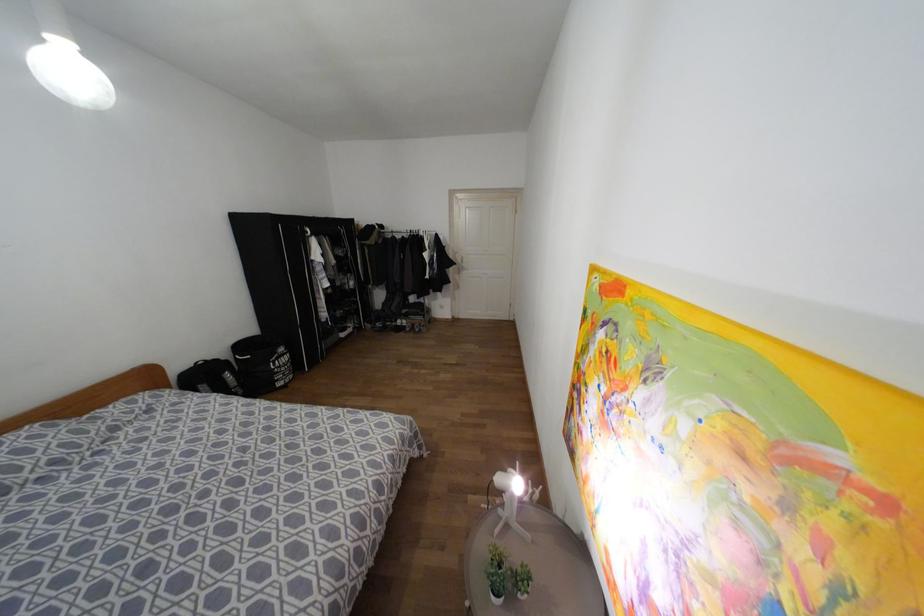
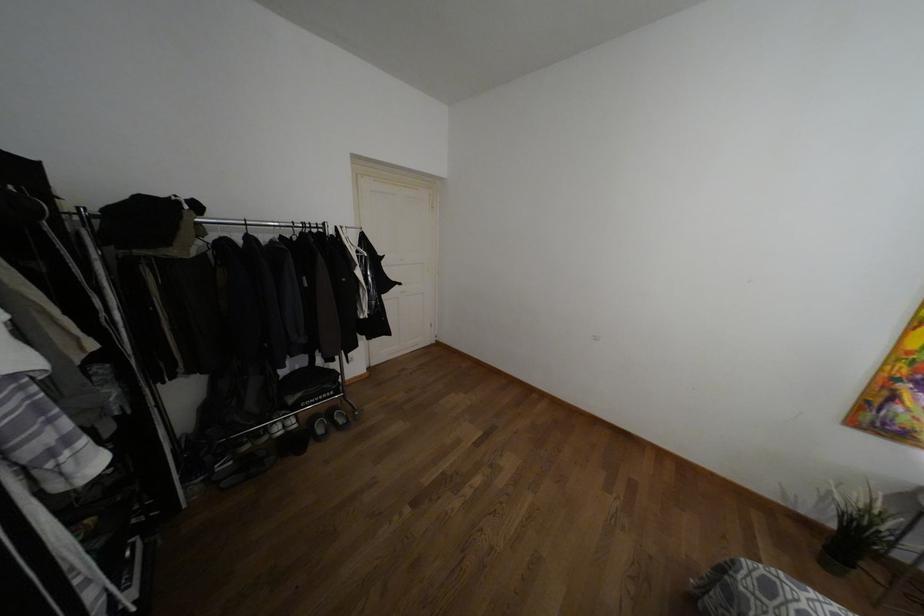
In the second image, find the point that corresponds to the point at 416,330 in the first image.

(341, 419)